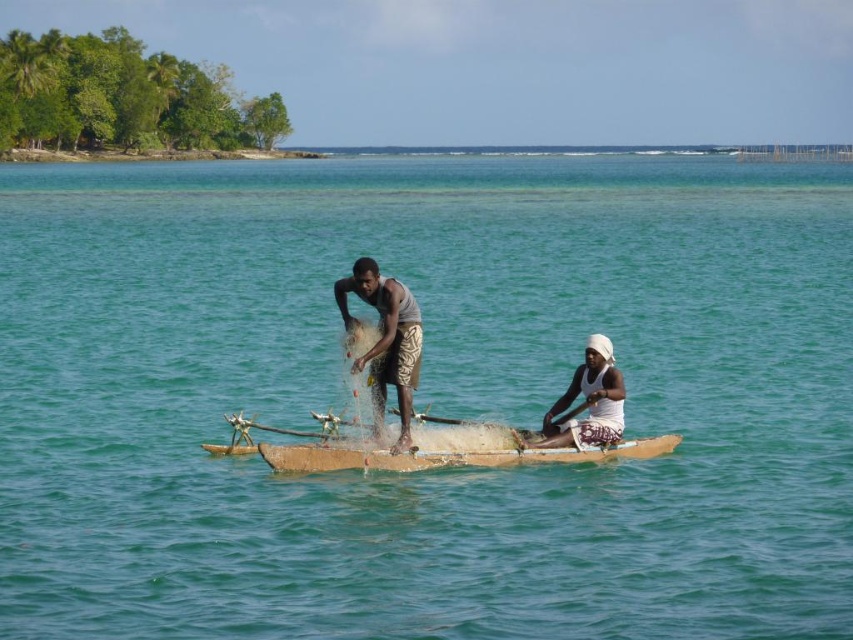
You are a photographer trying to capture a closeup of the gray fabric net at center and the white woven hat at center. Which object should you zoom in on more to ensure both are clearly visible in the photo?

Since the gray fabric net at center is smaller than the white woven hat at center, you should zoom in more on the gray fabric net at center to ensure both objects are clearly visible in the photo.

You are planning to store a white woven hat at center and a brown wooden canoe at center in a storage room. Which item should you place first if the storage entrance is narrow and only allows one large item at a time?

The brown wooden canoe at center has a smaller size compared to the white woven hat at center, so you should place the white woven hat at center first because it is larger and needs more space when entering the narrow storage entrance.

You are a drone operator tasked with capturing aerial footage of the gray fabric net at center. Your drone is currently hovering at point (386, 340). Is the drone positioned directly above the gray fabric net at center?

Yes, the drone is positioned directly above the gray fabric net at center because the gray fabric net at center is located at point (386, 340).